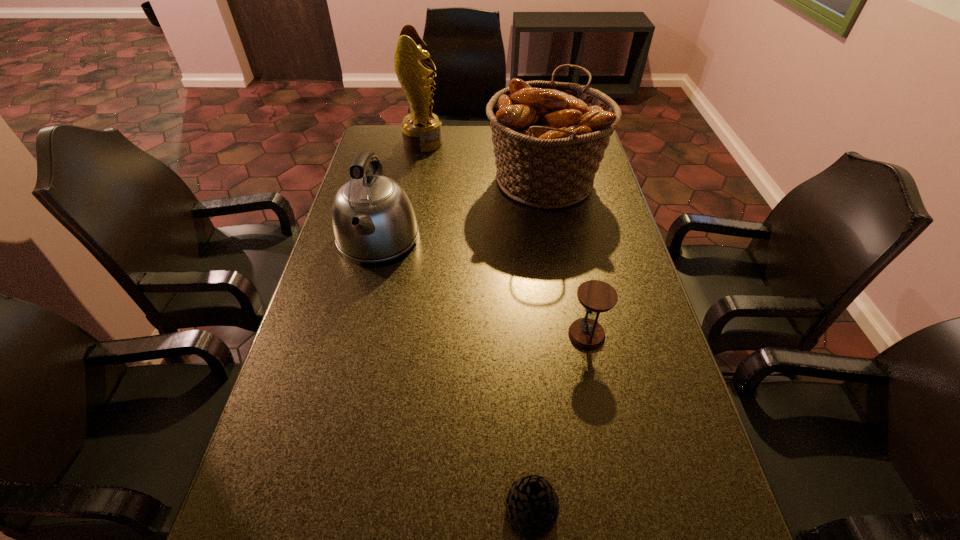
The width and height of the screenshot is (960, 540). Find the location of `the tallest object`. the tallest object is located at coordinates (421, 129).

Image resolution: width=960 pixels, height=540 pixels. Identify the location of basket. (549, 138).

Find the location of a particular element. kettle is located at coordinates (373, 219).

Identify the location of the second nearest object. (595, 296).

Locate an element on the screen. Image resolution: width=960 pixels, height=540 pixels. hourglass is located at coordinates (595, 296).

I want to click on the nearest object, so click(532, 504).

At what (x,y) coordinates should I click in order to perform the action: click on the shortest object. Please return your answer as a coordinate pair (x, y). The image size is (960, 540). Looking at the image, I should click on (532, 504).

Find the location of `vacant area situated on the front-facing side of the award`. vacant area situated on the front-facing side of the award is located at coordinates (520, 143).

Locate an element on the screen. Image resolution: width=960 pixels, height=540 pixels. vacant space located 0.150m on the front of the basket is located at coordinates (558, 254).

Where is `vacant space located 0.340m on the spout of the third tallest object`? The width and height of the screenshot is (960, 540). vacant space located 0.340m on the spout of the third tallest object is located at coordinates pos(341,389).